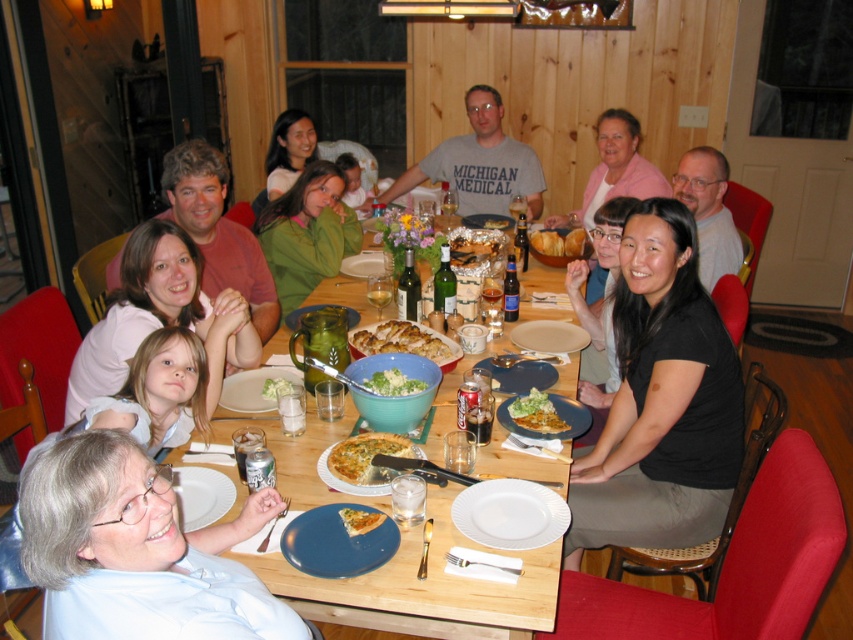
Which is below, matte pink shirt at upper left or golden brown crusty bread at center?

golden brown crusty bread at center is lower down.

Does matte pink shirt at upper left lie in front of golden brown crusty bread at center?

No, matte pink shirt at upper left is further to the viewer.

The height and width of the screenshot is (640, 853). What are the coordinates of `matte pink shirt at upper left` in the screenshot? It's located at (218, 230).

Is black matte shirt at center to the right of golden flaky quiche at center from the viewer's perspective?

Indeed, black matte shirt at center is positioned on the right side of golden flaky quiche at center.

Is black matte shirt at center thinner than golden flaky quiche at center?

Incorrect, black matte shirt at center's width is not less than golden flaky quiche at center's.

Does point (683, 433) lie in front of point (347, 461)?

That is False.

Find the location of a particular element. This screenshot has height=640, width=853. black matte shirt at center is located at coordinates (660, 401).

Is white paper plate at lower center below golden flaky quiche at center?

Correct, white paper plate at lower center is located below golden flaky quiche at center.

Does white paper plate at lower center lie in front of golden flaky quiche at center?

Yes, white paper plate at lower center is closer to the viewer.

At what (x,y) coordinates should I click in order to perform the action: click on white paper plate at lower center. Please return your answer as a coordinate pair (x, y). Looking at the image, I should click on (509, 513).

Identify the location of white paper plate at lower center. (509, 513).